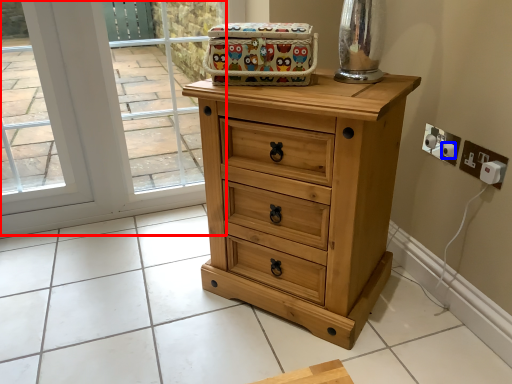
Question: Which of the following is the farthest to the observer, glass door (highlighted by a red box) or knob (highlighted by a blue box)?

Choices:
 (A) glass door
 (B) knob

Answer: (A)